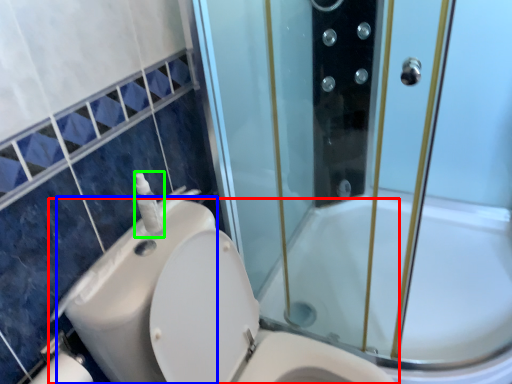
Question: Considering the real-world distances, which object is closest to toilet (highlighted by a red box)? sink (highlighted by a blue box) or soap dispenser (highlighted by a green box).

Choices:
 (A) sink
 (B) soap dispenser

Answer: (A)